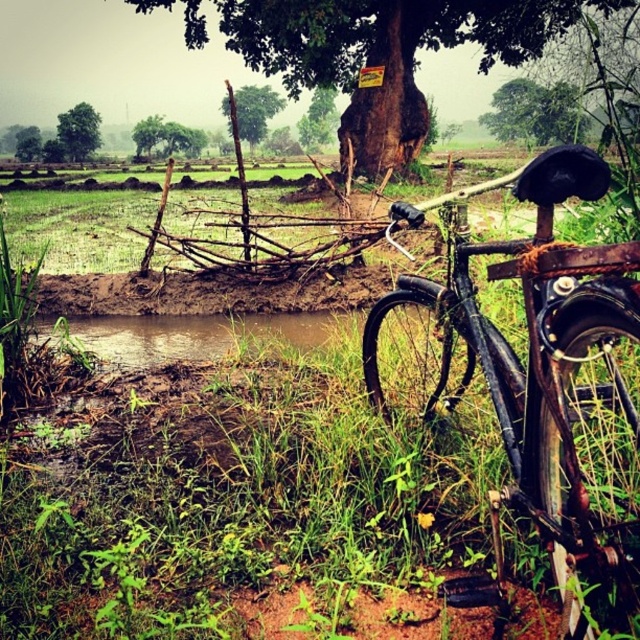
Based on the photo, does brown rough tree at center have a lesser height compared to green leafy tree at upper left?

No, brown rough tree at center is not shorter than green leafy tree at upper left.

Is brown rough tree at center to the left of green leafy tree at upper left from the viewer's perspective?

No, brown rough tree at center is not to the left of green leafy tree at upper left.

The width and height of the screenshot is (640, 640). Find the location of `brown rough tree at center`. brown rough tree at center is located at coordinates (376, 51).

Where is `brown rough tree at center`? This screenshot has width=640, height=640. brown rough tree at center is located at coordinates (376, 51).

Does rusty metal bicycle at right have a lesser height compared to green rough bark tree at upper center?

Yes, rusty metal bicycle at right is shorter than green rough bark tree at upper center.

Is point (525, 497) less distant than point (16, 148)?

Yes, it is in front of point (16, 148).

The width and height of the screenshot is (640, 640). I want to click on rusty metal bicycle at right, so click(534, 372).

Does brown rough tree at center have a greater height compared to green matte tree at upper center?

In fact, brown rough tree at center may be shorter than green matte tree at upper center.

Is brown rough tree at center closer to the viewer compared to green matte tree at upper center?

That is True.

What do you see at coordinates (376, 51) in the screenshot? I see `brown rough tree at center` at bounding box center [376, 51].

You are a GUI agent. You are given a task and a screenshot of the screen. Output one action in this format:
    pyautogui.click(x=<x>, y=<y>)
    Task: Click on the brown rough tree at center
    This screenshot has height=640, width=640.
    Given the screenshot: What is the action you would take?
    [x=376, y=51]